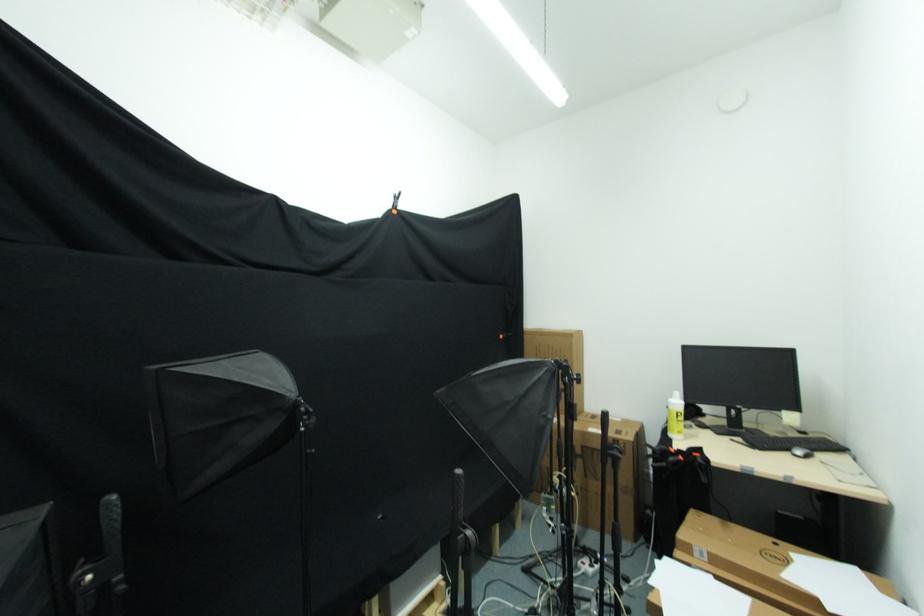
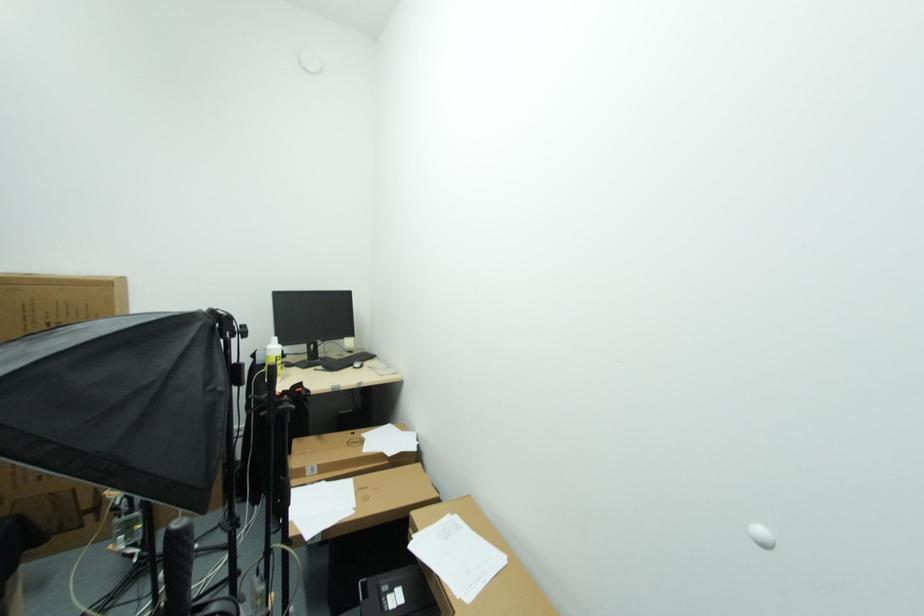
Find the pixel in the second image that matches (682,418) in the first image.

(280, 361)